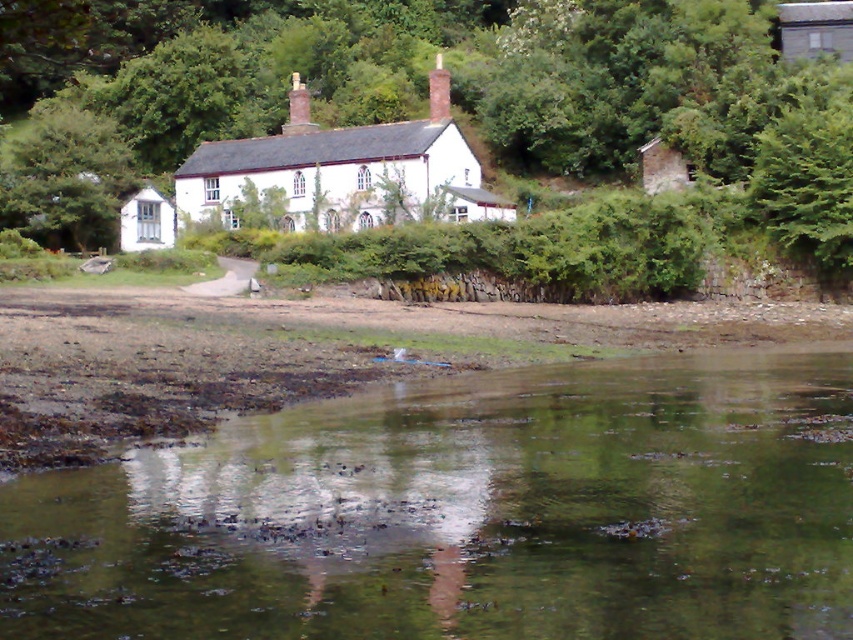
Consider the image. You are standing at the edge of the property near the stone wall and want to take a photo of the green reflective water at lower center and the green leafy tree at upper left. Which object will appear taller in the photo?

The green leafy tree at upper left will appear taller in the photo since it has a greater height than the green reflective water at lower center.

You are standing at the point marked by the coordinates point (467, 513) in the image. What is the name of the object you are currently standing on?

The point (467, 513) corresponds to the green reflective water at lower center, so you are standing on the green reflective water at lower center.

You are planning to install a new satellite dish on the tallest object in the scene. Based on the image, which object should you choose between the green leafy tree at upper center and the white matte cottage at left?

The green leafy tree at upper center is taller than the white matte cottage at left, so you should install the satellite dish on the green leafy tree at upper center.